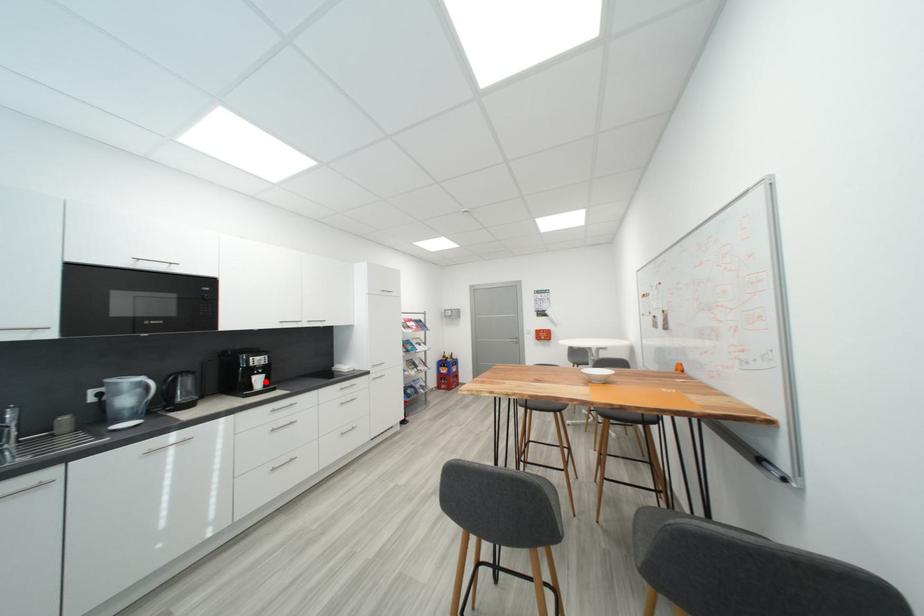
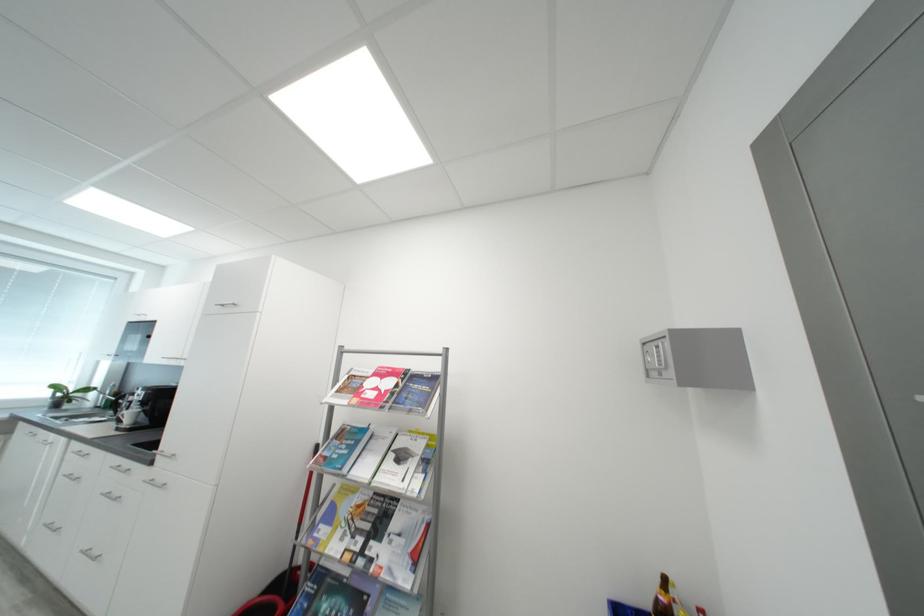
Where in the second image is the point corresponding to the highlighted location from the first image?

(138, 416)